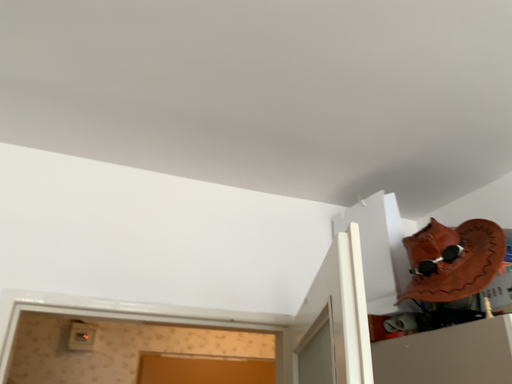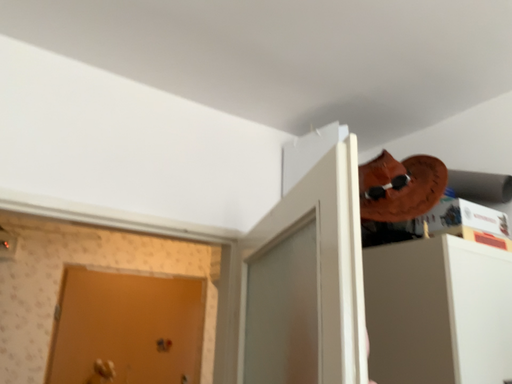
Question: How did the camera likely rotate when shooting the video?

Choices:
 (A) rotated right
 (B) rotated left

Answer: (A)